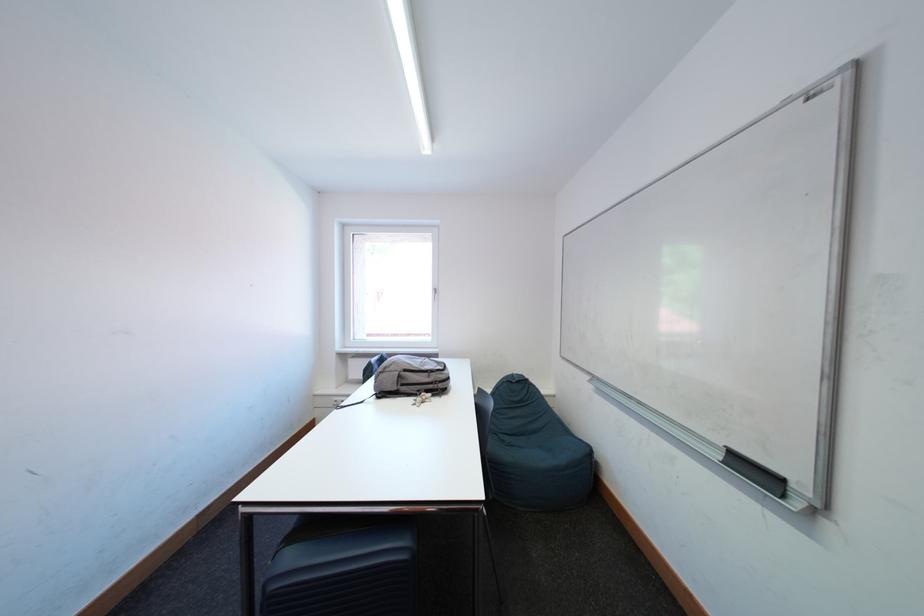
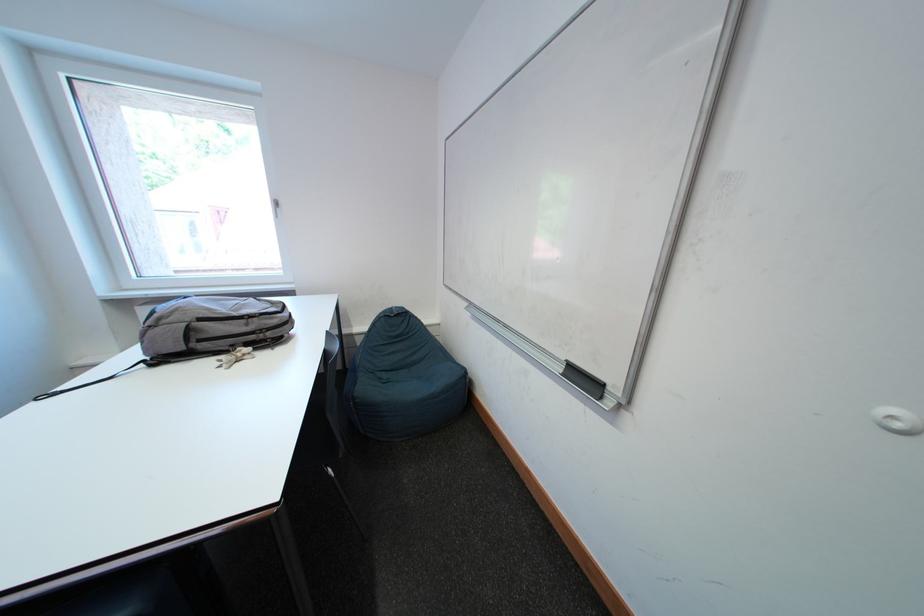
In the second image, find the point that corresponds to (435,378) in the first image.

(252, 325)